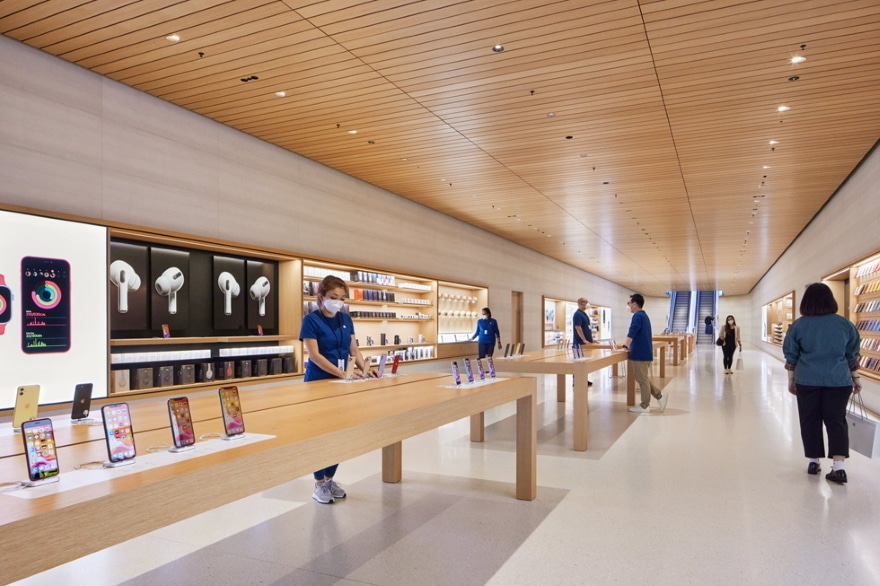
Identify the location of floor. This screenshot has height=586, width=880. (643, 528).